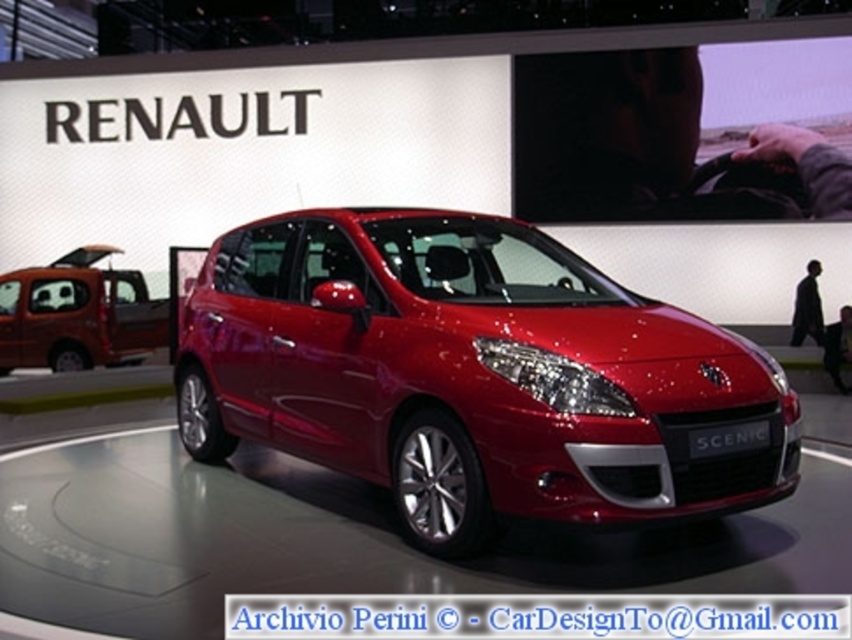
Question: Can you confirm if glossy red car at center is positioned above matte orange van at left?

Choices:
 (A) yes
 (B) no

Answer: (B)

Question: Does glossy red car at center have a smaller size compared to matte orange van at left?

Choices:
 (A) no
 (B) yes

Answer: (A)

Question: Can you confirm if glossy red car at center is smaller than matte orange van at left?

Choices:
 (A) no
 (B) yes

Answer: (A)

Question: Which point is closer to the camera?

Choices:
 (A) (421, 214)
 (B) (72, 266)

Answer: (A)

Question: Which point is farther to the camera?

Choices:
 (A) matte orange van at left
 (B) glossy red car at center

Answer: (A)